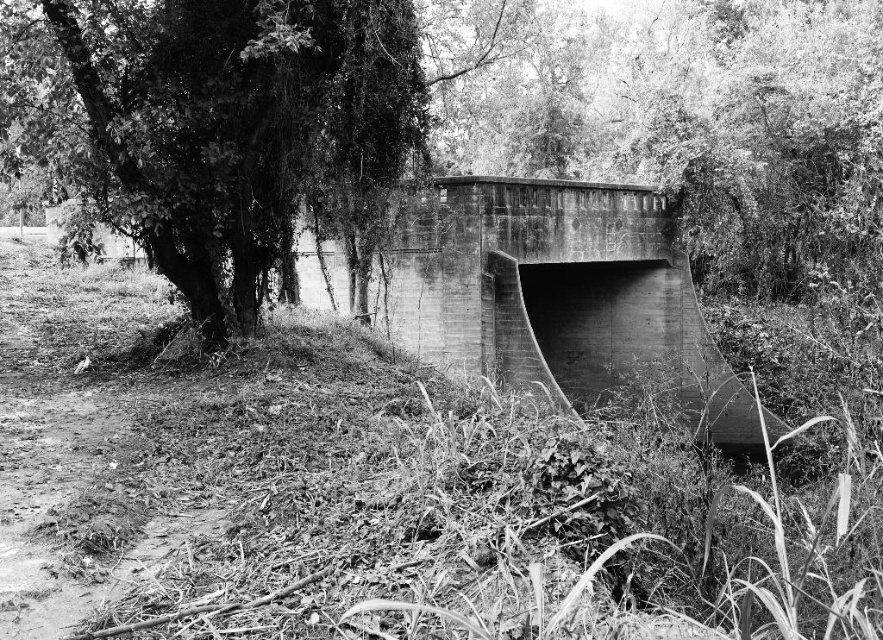
Question: Does green leafy tree at left appear on the left side of concrete bridge at center?

Choices:
 (A) no
 (B) yes

Answer: (B)

Question: Considering the relative positions of green leafy tree at left and concrete bridge at center in the image provided, where is green leafy tree at left located with respect to concrete bridge at center?

Choices:
 (A) left
 (B) right

Answer: (A)

Question: Which object appears closest to the camera in this image?

Choices:
 (A) concrete bridge at center
 (B) green leafy tree at left

Answer: (B)

Question: Can you confirm if green leafy tree at left is positioned below concrete bridge at center?

Choices:
 (A) yes
 (B) no

Answer: (B)

Question: Which of the following is the closest to the observer?

Choices:
 (A) (231, 209)
 (B) (510, 237)

Answer: (A)